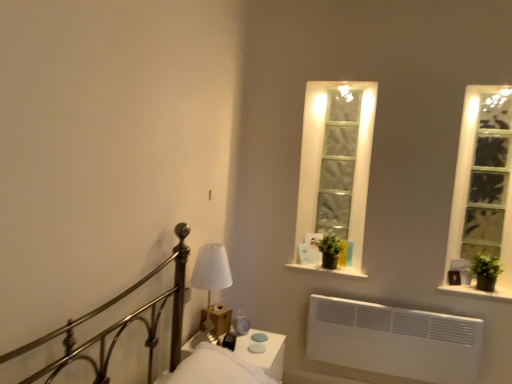
Question: Could you tell me if green matte plant at right, the 1th plant from the right, is facing clear glass window at right?

Choices:
 (A) no
 (B) yes

Answer: (A)

Question: Is clear glass window at right a part of green matte plant at right, the 1th plant from the right?

Choices:
 (A) no
 (B) yes

Answer: (A)

Question: Is green matte plant at right, which ranks as the 2th plant in left-to-right order, positioned before clear glass window at right?

Choices:
 (A) yes
 (B) no

Answer: (A)

Question: Does green matte plant at right, which ranks as the 2th plant in left-to-right order, have a greater height compared to clear glass window at right?

Choices:
 (A) yes
 (B) no

Answer: (B)

Question: Is green matte plant at right, which appears as the first plant when viewed from the front, at the left side of clear glass window at right?

Choices:
 (A) yes
 (B) no

Answer: (A)

Question: Considering the positions of point (199, 281) and point (156, 329), is point (199, 281) closer or farther from the camera than point (156, 329)?

Choices:
 (A) closer
 (B) farther

Answer: (B)

Question: Is white fabric lampshade at center in front of or behind metallic bed at left in the image?

Choices:
 (A) behind
 (B) front

Answer: (A)

Question: Is white fabric lampshade at center taller or shorter than metallic bed at left?

Choices:
 (A) tall
 (B) short

Answer: (B)

Question: Would you say white fabric lampshade at center is to the left or to the right of metallic bed at left in the picture?

Choices:
 (A) right
 (B) left

Answer: (B)

Question: Considering the positions of green matte plant at right, which is the first window sill in right-to-left order, and black matte window sill at center, the 2th window sill from the bottom, in the image, is green matte plant at right, which is the first window sill in right-to-left order, bigger or smaller than black matte window sill at center, the 2th window sill from the bottom,?

Choices:
 (A) small
 (B) big

Answer: (A)

Question: From a real-world perspective, is green matte plant at right, which ranks as the 2th window sill in left-to-right order, physically located above or below black matte window sill at center, which appears as the 2th window sill when viewed from the right?

Choices:
 (A) above
 (B) below

Answer: (B)

Question: Is green matte plant at right, which is the first window sill in right-to-left order, taller or shorter than black matte window sill at center, the 1th window sill when ordered from top to bottom?

Choices:
 (A) short
 (B) tall

Answer: (A)

Question: From the image's perspective, is green matte plant at right, which ranks as the 2th window sill in left-to-right order, positioned above or below black matte window sill at center, the 1th window sill in the left-to-right sequence?

Choices:
 (A) below
 (B) above

Answer: (A)

Question: From their relative heights in the image, would you say green matte plant at right, which appears as the first plant when viewed from the front, is taller or shorter than clear glass window at right?

Choices:
 (A) short
 (B) tall

Answer: (A)

Question: Choose the correct answer: Is green matte plant at right, the 1th plant from the right, inside clear glass window at right or outside it?

Choices:
 (A) inside
 (B) outside

Answer: (B)